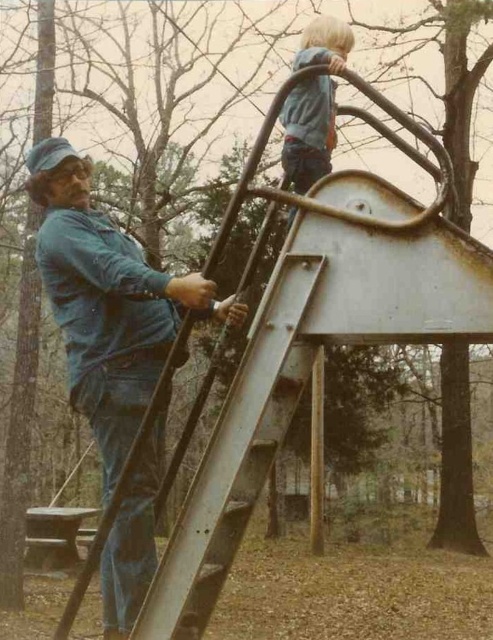
Question: Is blue denim jeans at left further to the viewer compared to blue matte jacket at upper center?

Choices:
 (A) no
 (B) yes

Answer: (A)

Question: Can you confirm if blue denim jeans at left is wider than blue matte jacket at upper center?

Choices:
 (A) yes
 (B) no

Answer: (A)

Question: Is blue denim jeans at left wider than blue matte jacket at upper center?

Choices:
 (A) no
 (B) yes

Answer: (B)

Question: Which point is closer to the camera?

Choices:
 (A) (142, 296)
 (B) (327, 166)

Answer: (A)

Question: Which object is farther from the camera taking this photo?

Choices:
 (A) blue matte jacket at upper center
 (B) blue denim jeans at left

Answer: (A)